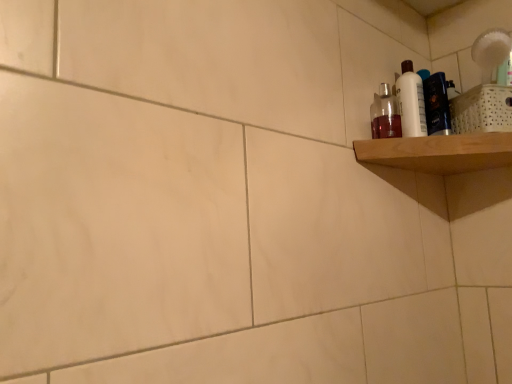
Question: Can you confirm if wooden shelf at upper right is thinner than translucent plastic bottle at upper right?

Choices:
 (A) yes
 (B) no

Answer: (B)

Question: Is wooden shelf at upper right touching translucent plastic bottle at upper right?

Choices:
 (A) no
 (B) yes

Answer: (A)

Question: Is wooden shelf at upper right positioned in front of translucent plastic bottle at upper right?

Choices:
 (A) no
 (B) yes

Answer: (B)

Question: Is wooden shelf at upper right surrounding translucent plastic bottle at upper right?

Choices:
 (A) no
 (B) yes

Answer: (A)

Question: Is wooden shelf at upper right bigger than translucent plastic bottle at upper right?

Choices:
 (A) yes
 (B) no

Answer: (A)

Question: Can you confirm if wooden shelf at upper right is shorter than translucent plastic bottle at upper right?

Choices:
 (A) no
 (B) yes

Answer: (B)

Question: Can you confirm if translucent plastic bottle at upper right is bigger than wooden shelf at upper right?

Choices:
 (A) no
 (B) yes

Answer: (A)

Question: Is there a large distance between translucent plastic bottle at upper right and wooden shelf at upper right?

Choices:
 (A) no
 (B) yes

Answer: (A)

Question: Does translucent plastic bottle at upper right appear on the left side of wooden shelf at upper right?

Choices:
 (A) yes
 (B) no

Answer: (A)

Question: From the image's perspective, is translucent plastic bottle at upper right below wooden shelf at upper right?

Choices:
 (A) no
 (B) yes

Answer: (A)

Question: From the image's perspective, is translucent plastic bottle at upper right above wooden shelf at upper right?

Choices:
 (A) yes
 (B) no

Answer: (A)

Question: Can you confirm if translucent plastic bottle at upper right is positioned to the right of wooden shelf at upper right?

Choices:
 (A) yes
 (B) no

Answer: (B)

Question: Is white glossy bottle at upper right oriented away from translucent plastic bottle at upper right?

Choices:
 (A) no
 (B) yes

Answer: (A)